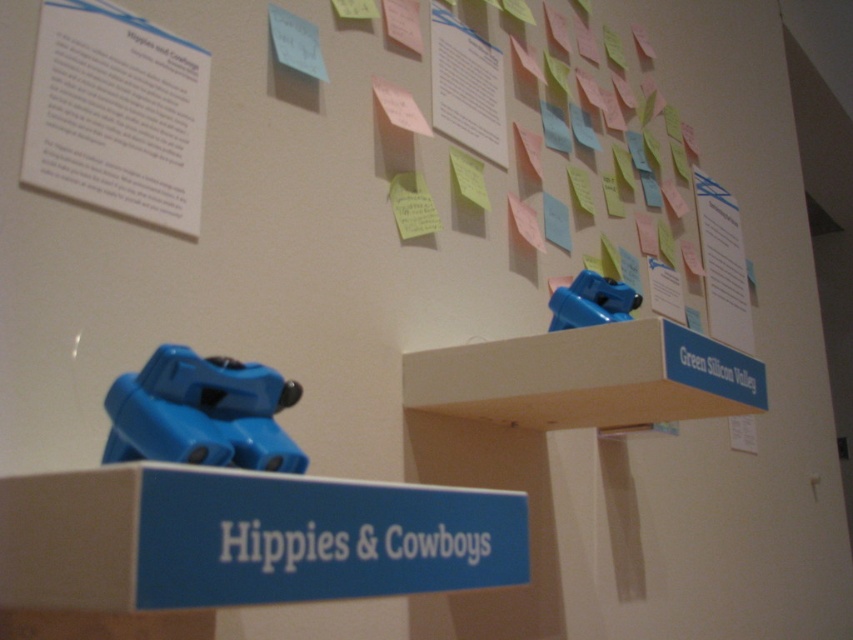
Question: Does blue plastic sign at center have a smaller size compared to blue plastic toy at upper right?

Choices:
 (A) yes
 (B) no

Answer: (B)

Question: Based on their relative distances, which object is farther from the green matte sign at upper right?

Choices:
 (A) white wood shelf at upper center
 (B) blue plastic sign at center
 (C) blue plastic toy at upper right

Answer: (B)

Question: Which object appears farthest from the camera in this image?

Choices:
 (A) white matte sign at center
 (B) white wood shelf at upper center

Answer: (B)

Question: Which of the following is the farthest from the observer?

Choices:
 (A) blue plastic toy gun at lower center
 (B) green matte sign at upper right
 (C) white wood shelf at upper center

Answer: (B)

Question: Does white matte sign at center appear over green matte sign at upper right?

Choices:
 (A) yes
 (B) no

Answer: (B)

Question: From the image, what is the correct spatial relationship of blue plastic sign at center in relation to white wood shelf at upper center?

Choices:
 (A) right
 (B) left

Answer: (B)